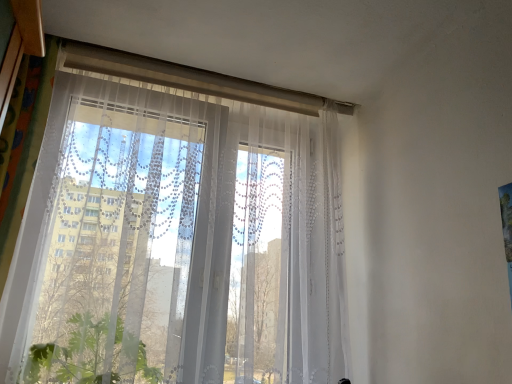
What is the approximate height of transparent lace curtains at center?

transparent lace curtains at center is 1.04 meters tall.

Identify the location of transparent lace curtains at center. Image resolution: width=512 pixels, height=384 pixels. (177, 243).

Measure the distance between transparent lace curtains at center and camera.

transparent lace curtains at center is 1.15 meters away from camera.

This screenshot has width=512, height=384. Describe the element at coordinates (177, 243) in the screenshot. I see `transparent lace curtains at center` at that location.

Locate an element on the screen. This screenshot has width=512, height=384. transparent lace curtains at center is located at coordinates (177, 243).